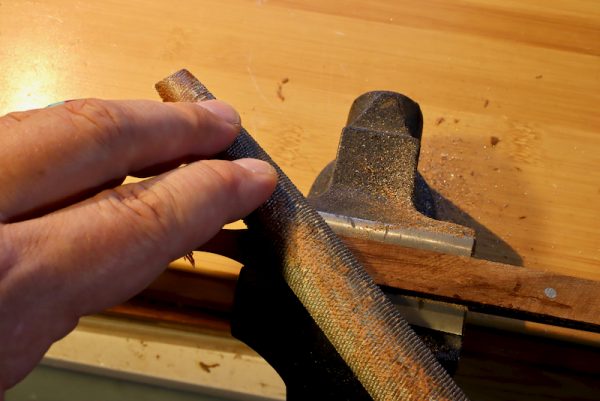
The image size is (600, 401). Identify the location of dark brown wooden piece. (485, 279).